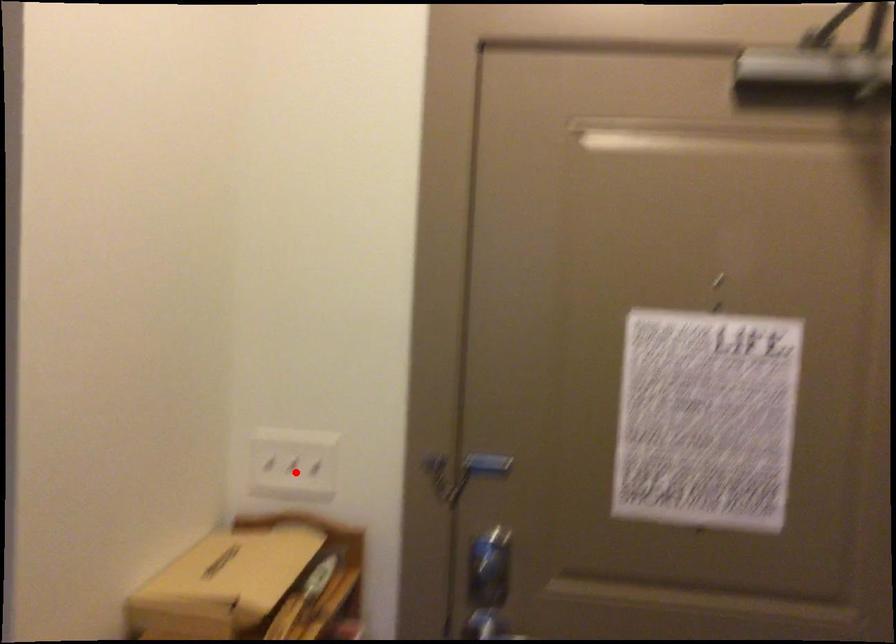
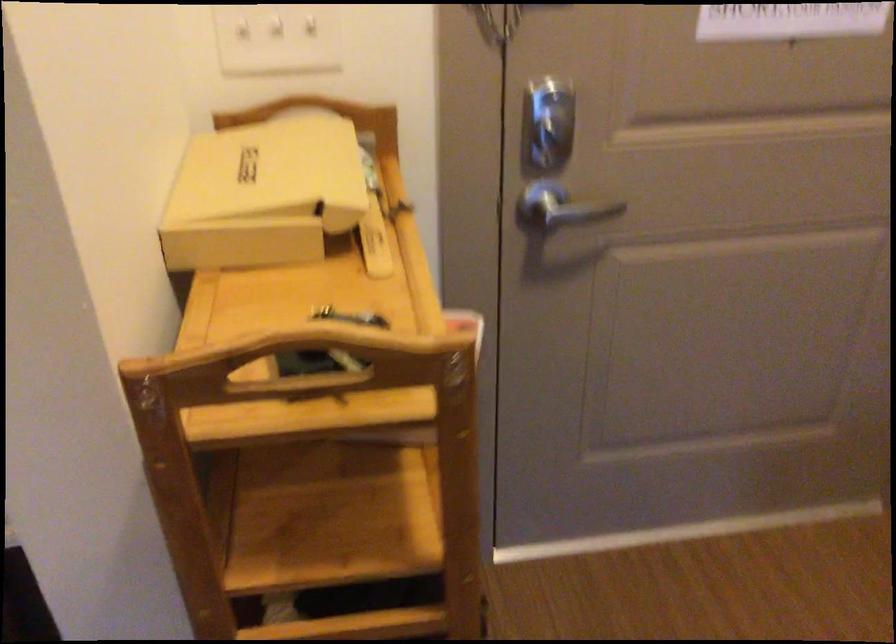
Question: I am providing you with two images of the same scene from different viewpoints. Image1 has a red point marked. In image2, the corresponding 3D location appears at what relative position? Reply with the corresponding letter.

Choices:
 (A) Closer
 (B) Farther

Answer: (A)